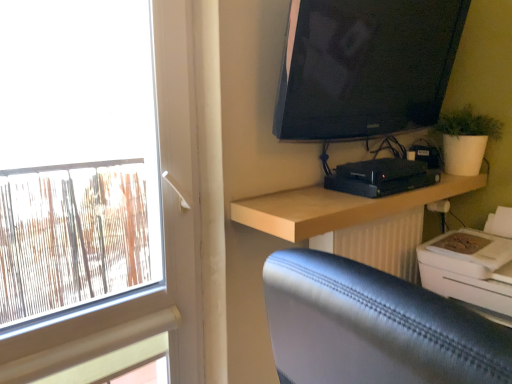
Question: Should I look upward or downward to see white plastic printer at lower right?

Choices:
 (A) down
 (B) up

Answer: (A)

Question: From the image's perspective, is white plastic printer at lower right on white matte window at left?

Choices:
 (A) yes
 (B) no

Answer: (B)

Question: From a real-world perspective, is white plastic printer at lower right located higher than white matte window at left?

Choices:
 (A) yes
 (B) no

Answer: (B)

Question: Can you confirm if white plastic printer at lower right is positioned to the left of white matte window at left?

Choices:
 (A) no
 (B) yes

Answer: (A)

Question: Can you confirm if white plastic printer at lower right is shorter than white matte window at left?

Choices:
 (A) yes
 (B) no

Answer: (A)

Question: Is white plastic printer at lower right positioned with its back to white matte window at left?

Choices:
 (A) yes
 (B) no

Answer: (B)

Question: Is white plastic printer at lower right wider than white matte window at left?

Choices:
 (A) no
 (B) yes

Answer: (B)

Question: From a real-world perspective, is black plastic device at center on black glossy tv at upper right?

Choices:
 (A) yes
 (B) no

Answer: (B)

Question: Does black plastic device at center turn towards black glossy tv at upper right?

Choices:
 (A) yes
 (B) no

Answer: (B)

Question: Is the position of black plastic device at center more distant than that of black glossy tv at upper right?

Choices:
 (A) no
 (B) yes

Answer: (B)

Question: Does black plastic device at center have a greater width compared to black glossy tv at upper right?

Choices:
 (A) yes
 (B) no

Answer: (A)

Question: Considering the relative sizes of black plastic device at center and black glossy tv at upper right in the image provided, is black plastic device at center shorter than black glossy tv at upper right?

Choices:
 (A) no
 (B) yes

Answer: (B)

Question: Is black plastic device at center oriented away from black glossy tv at upper right?

Choices:
 (A) yes
 (B) no

Answer: (B)

Question: Is light wood shelf at upper right at the left side of white plastic printer at lower right?

Choices:
 (A) yes
 (B) no

Answer: (A)